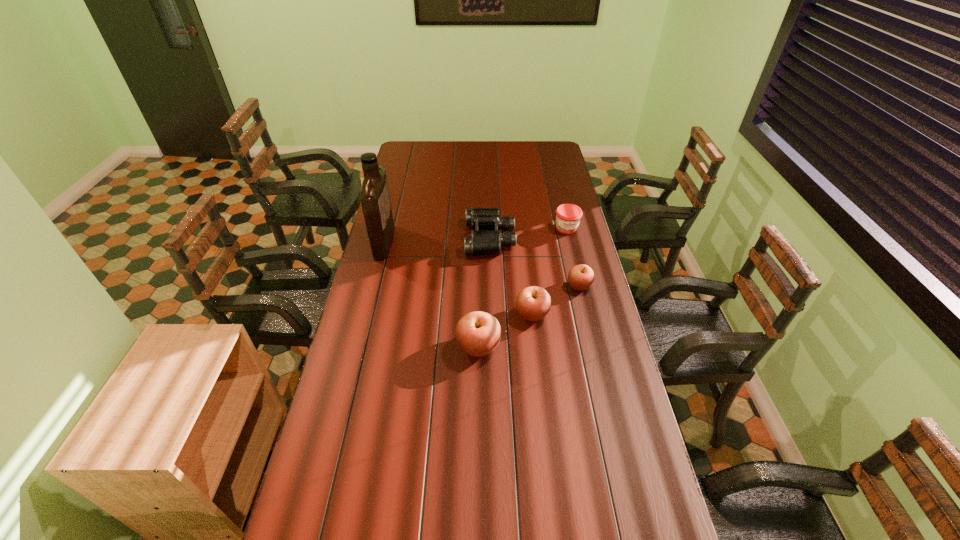
The height and width of the screenshot is (540, 960). I want to click on the second tallest object, so click(477, 333).

Identify the location of the leftmost apple. (477, 333).

You are a GUI agent. You are given a task and a screenshot of the screen. Output one action in this format:
    pyautogui.click(x=<x>, y=<y>)
    Task: Click on the second apple from right to left
    Image resolution: width=960 pixels, height=540 pixels.
    Given the screenshot: What is the action you would take?
    pyautogui.click(x=533, y=303)

You are a GUI agent. You are given a task and a screenshot of the screen. Output one action in this format:
    pyautogui.click(x=<x>, y=<y>)
    Task: Click on the second nearest apple
    This screenshot has height=540, width=960.
    Given the screenshot: What is the action you would take?
    pyautogui.click(x=533, y=303)

The width and height of the screenshot is (960, 540). Identify the location of the third nearest object. (580, 277).

In order to click on the rightmost apple in this screenshot , I will do `click(580, 277)`.

At what (x,y) coordinates should I click in order to perform the action: click on binoculars. Please return your answer as a coordinate pair (x, y). Image resolution: width=960 pixels, height=540 pixels. Looking at the image, I should click on [x=481, y=242].

This screenshot has height=540, width=960. In order to click on the leftmost object in this screenshot , I will do `click(375, 200)`.

Find the location of a particular element. This screenshot has width=960, height=540. liquor is located at coordinates (375, 200).

The width and height of the screenshot is (960, 540). I want to click on jam, so click(568, 216).